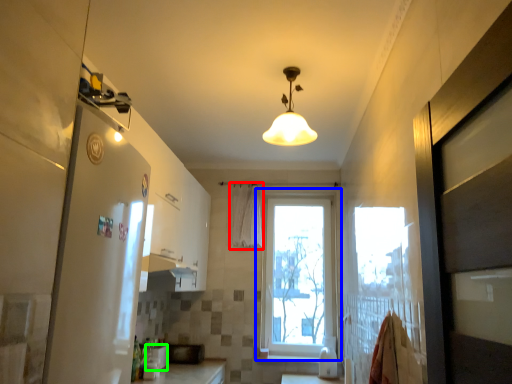
Question: Estimate the real-world distances between objects in this image. Which object is closer to shower curtain (highlighted by a red box), window (highlighted by a blue box) or appliance (highlighted by a green box)?

Choices:
 (A) window
 (B) appliance

Answer: (A)